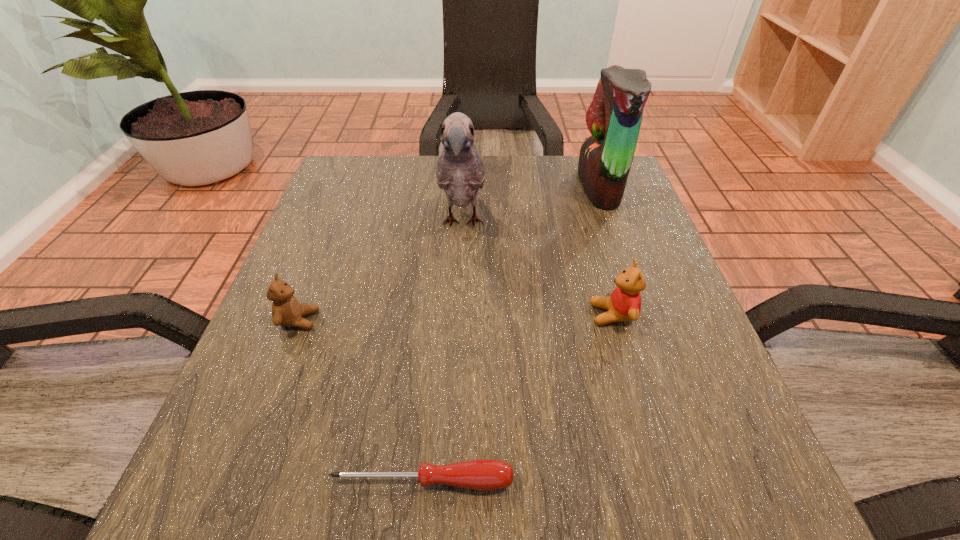
Find the location of a particular element. the right parrot is located at coordinates (614, 117).

This screenshot has height=540, width=960. Find the location of `the left parrot`. the left parrot is located at coordinates (460, 170).

Find the location of a particular element. The image size is (960, 540). the right teddy bear is located at coordinates (624, 304).

The height and width of the screenshot is (540, 960). I want to click on the leftmost object, so click(x=286, y=310).

This screenshot has height=540, width=960. Find the location of `the left teddy bear`. the left teddy bear is located at coordinates (286, 310).

Image resolution: width=960 pixels, height=540 pixels. What are the coordinates of `the shortest object` in the screenshot? It's located at (484, 474).

The height and width of the screenshot is (540, 960). In order to click on the nearest object in this screenshot , I will do `click(484, 474)`.

I want to click on free spot located 0.100m at the face of the right parrot, so click(x=539, y=187).

Identify the location of vacant space located 0.150m at the face of the right parrot. (517, 187).

The width and height of the screenshot is (960, 540). Identify the location of vacant space situated 0.390m at the face of the right parrot. (419, 187).